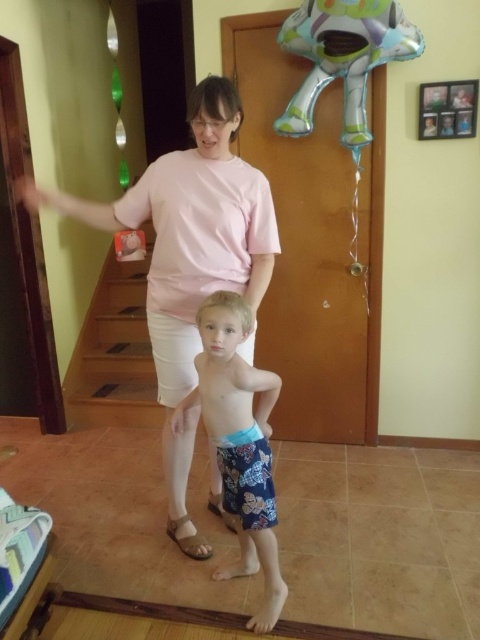
How much distance is there between tan suede sandal at lower center and brown leather sandal at lower center?

The distance of tan suede sandal at lower center from brown leather sandal at lower center is 16.98 centimeters.

Does tan suede sandal at lower center have a greater height compared to brown leather sandal at lower center?

Yes.

Between point (180, 532) and point (217, 513), which one is positioned behind?

The point (217, 513) is behind.

Identify the location of tan suede sandal at lower center. This screenshot has width=480, height=640. (188, 538).

Looking at this image, who is shorter, blue printed shorts at center or brown leather sandal at lower center?

brown leather sandal at lower center

Does blue printed shorts at center come in front of brown leather sandal at lower center?

Yes, it is.

Which is in front, point (272, 518) or point (207, 504)?

Point (272, 518)

Image resolution: width=480 pixels, height=640 pixels. I want to click on blue printed shorts at center, so click(x=239, y=442).

Locate an element on the screen. The image size is (480, 640). pink cotton shirt at upper center is located at coordinates (188, 248).

Between pink cotton shirt at upper center and metallic silver balloon at upper center, which one appears on the right side from the viewer's perspective?

From the viewer's perspective, metallic silver balloon at upper center appears more on the right side.

Which is in front, point (158, 320) or point (422, 49)?

Point (158, 320) is in front.

Identify the location of pink cotton shirt at upper center. The image size is (480, 640). (188, 248).